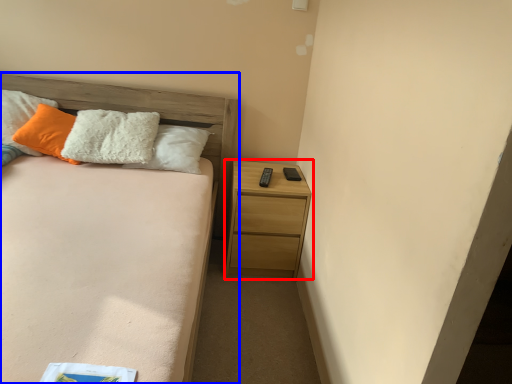
Question: Which of the following is the closest to the observer, nightstand (highlighted by a red box) or bed (highlighted by a blue box)?

Choices:
 (A) nightstand
 (B) bed

Answer: (B)